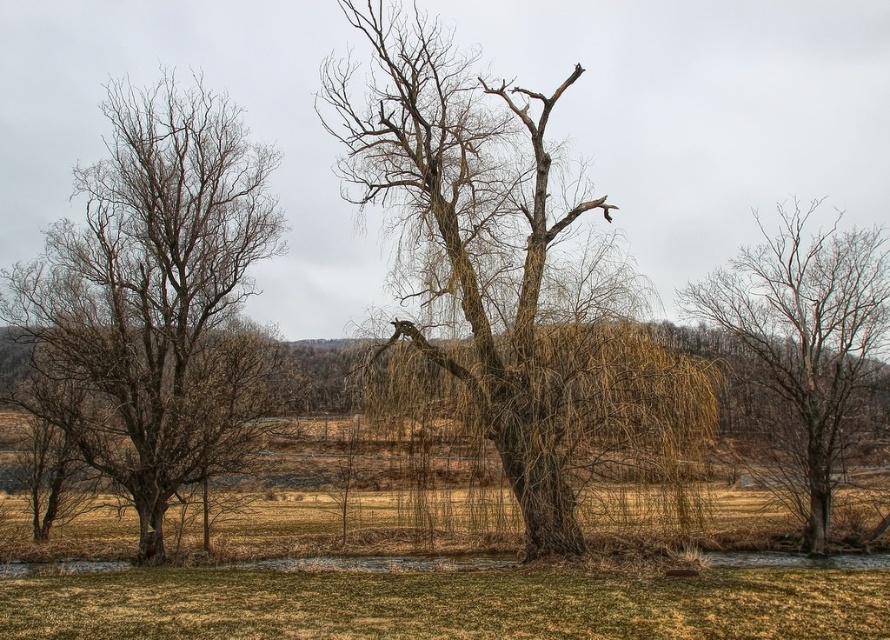
You are standing at the point marked by the coordinates point (502, 268) in the image. Looking around, you see the brown textured tree at center. Which direction should you face to see the brown textured tree at center?

Since you are standing at the point (502, 268), which represents the brown textured tree at center, you are already at the location of the tree. Therefore, you cannot see the tree from your current position.

You are standing in front of the large tree and notice two sets of branches. The first is the bare branches at left, and the second is the bare branches at center. From your perspective, which set of branches is positioned to the left?

The bare branches at left are positioned to the left of the bare branches at center.

You are standing at the origin point of the image, which is at coordinates point 0.0. Where is the brown textured tree at center located relative to your position?

The brown textured tree at center is located at point (502, 268), which is to the right and above your current position at point 0.0.